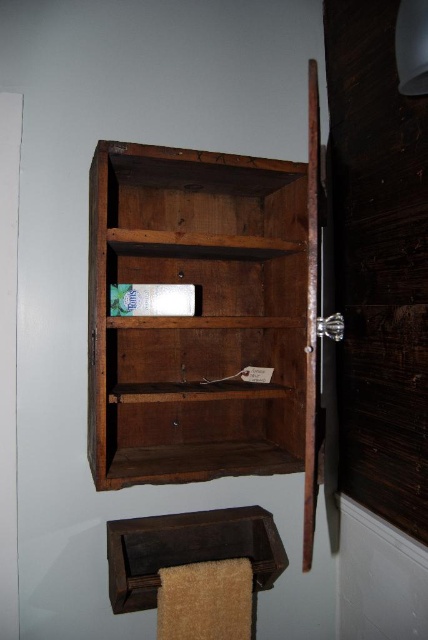
In the scene shown: Can you confirm if wooden bookshelf at center is positioned to the right of dark brown wood towel rack at lower center?

Yes, wooden bookshelf at center is to the right of dark brown wood towel rack at lower center.

Between wooden bookshelf at center and dark brown wood towel rack at lower center, which one appears on the left side from the viewer's perspective?

Positioned to the left is dark brown wood towel rack at lower center.

What do you see at coordinates (205, 316) in the screenshot? The height and width of the screenshot is (640, 428). I see `wooden bookshelf at center` at bounding box center [205, 316].

Locate an element on the screen. This screenshot has width=428, height=640. wooden bookshelf at center is located at coordinates (205, 316).